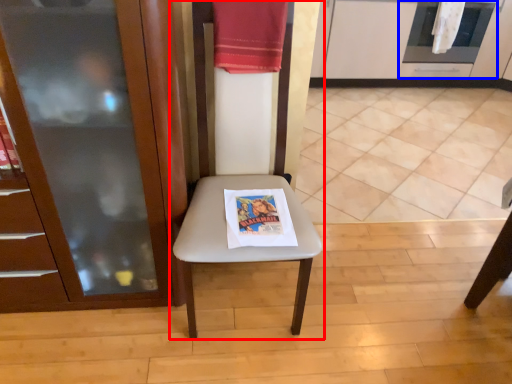
Question: Which point is closer to the camera, chair (highlighted by a red box) or oven (highlighted by a blue box)?

Choices:
 (A) chair
 (B) oven

Answer: (A)